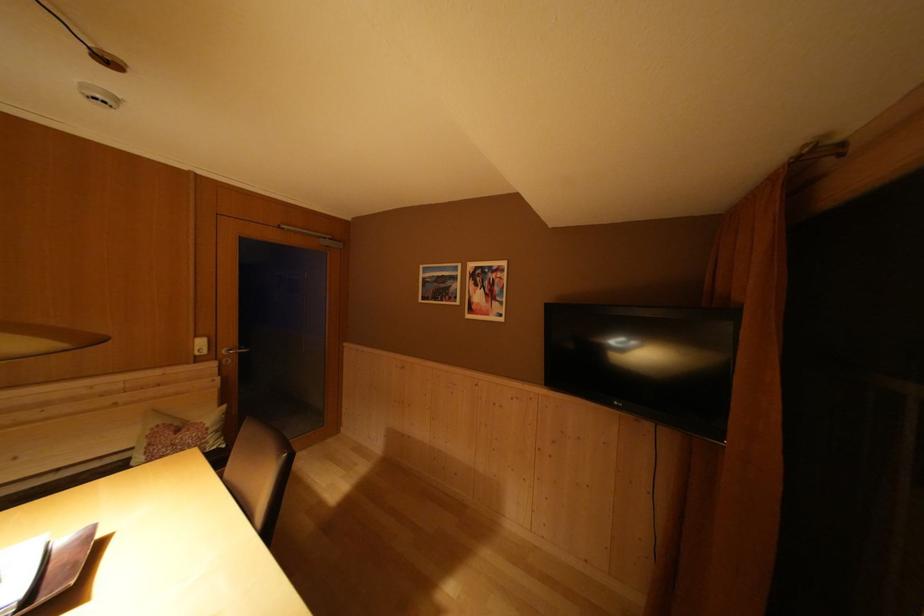
Where is `metal door handle`? metal door handle is located at coordinates (277, 328).